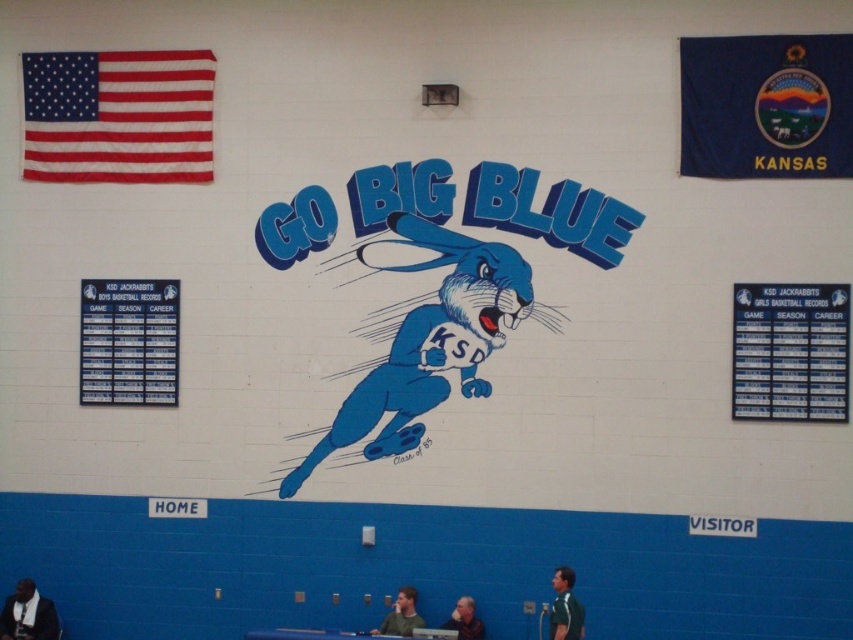
You are a photographer standing at the entrance of the gymnasium. You need to take a photo of the dark blue shirt at lower left and dark brown leather jacket at lower center. Can you fit both items in the frame if your camera has a maximum horizontal field of view of 18 feet?

The distance between the dark blue shirt at lower left and dark brown leather jacket at lower center is 18.53 feet. Since the camera can only capture up to 18 feet, the photographer cannot fit both items in the frame.

You are a gym trainer who needs to hand out a form to the person wearing the dark blue shirt at lower left and the dark brown leather jacket at lower center. Based on their positions, which one is closer to the entrance of the gym?

The dark blue shirt at lower left is to the left of dark brown leather jacket at lower center, so the dark blue shirt at lower left is closer to the entrance if the entrance is on the left side of the gym.

Looking at this image, you are a maintenance worker in the gymnasium. You need to reach both the textured fabric flag at upper left and the blue plastic scoreboard at left with a ladder that is 2 meters long. Can you safely reach both objects with the ladder without moving it?

The distance between the textured fabric flag at upper left and the blue plastic scoreboard at left is 1.79 meters, which is less than the ladder length of 2 meters. Therefore, you can safely reach both objects with the ladder without moving it.